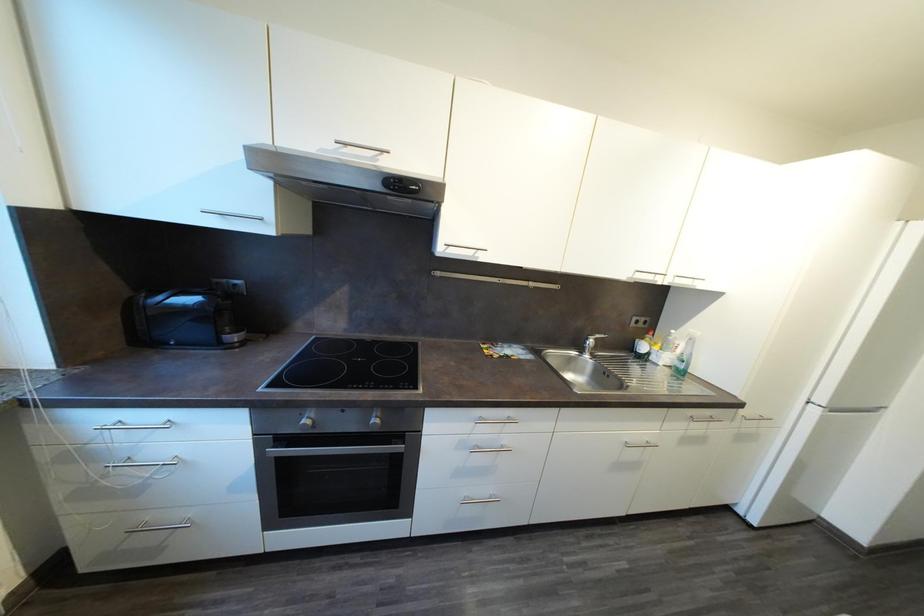
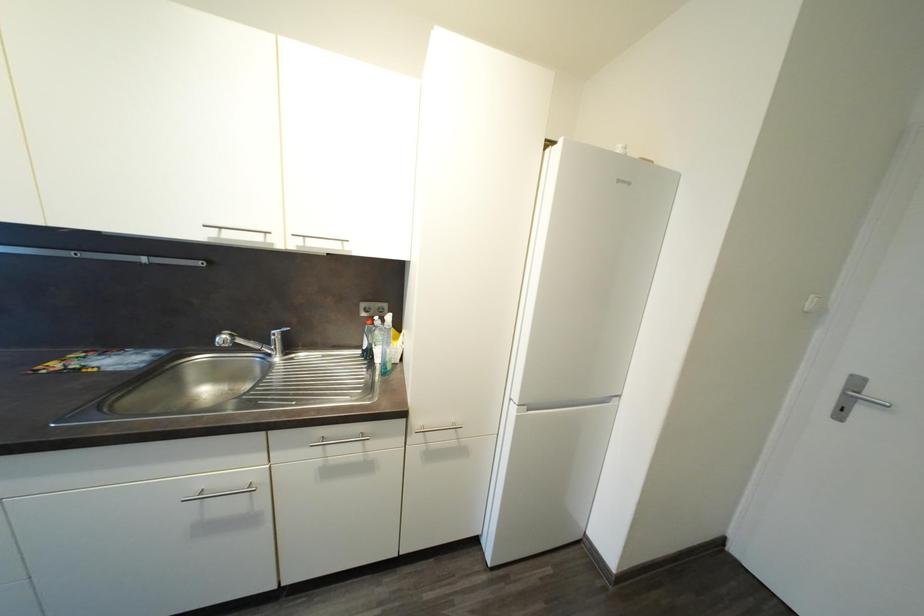
Question: The images are taken continuously from a first-person perspective. In which direction are you moving?

Choices:
 (A) Left
 (B) Right
 (C) Forward
 (D) Backward

Answer: (B)